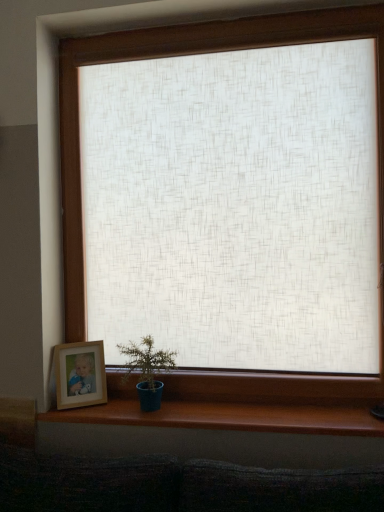
Locate an element on the screen. This screenshot has width=384, height=512. unoccupied region to the right of blue matte pot at lower left is located at coordinates (203, 408).